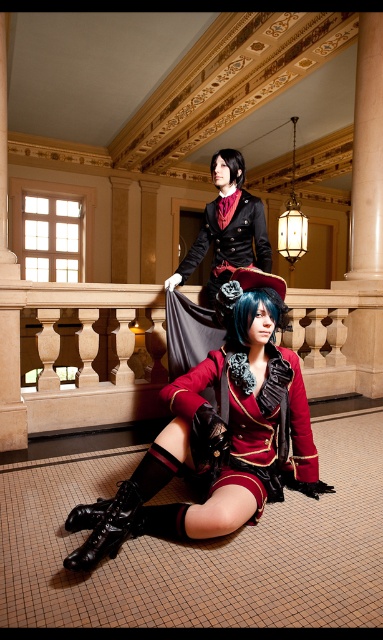
You are a tailor measuring the space between two coats to place a hanger. The velvet red coat at center and the matte black coat at upper center are in your way. Which coat has a larger width that could block your path?

The velvet red coat at center might be wider than the matte black coat at upper center, so it could block your path more.

You are a costume designer preparing for a photoshoot in this grand hall. You need to position a lighting stand between the matte black coat at upper center and the black matte hair at upper center. The stand requires 16 inches of space. Will there be enough space between them?

The distance between the matte black coat at upper center and the black matte hair at upper center is 15.68 inches, which is less than the required 16 inches. Therefore, there isn not enough space to place the lighting stand between them.

You are standing at the point labeled point (217, 211) and want to reach the door located across the room. There is a 2.5 meter wide sofa placed between you and the door. Can you walk around the sofa to reach the door?

The distance between you and the door is 3.14 meters, which is greater than the sofa width of 2.5 meters. Therefore, you can walk around the sofa to reach the door.